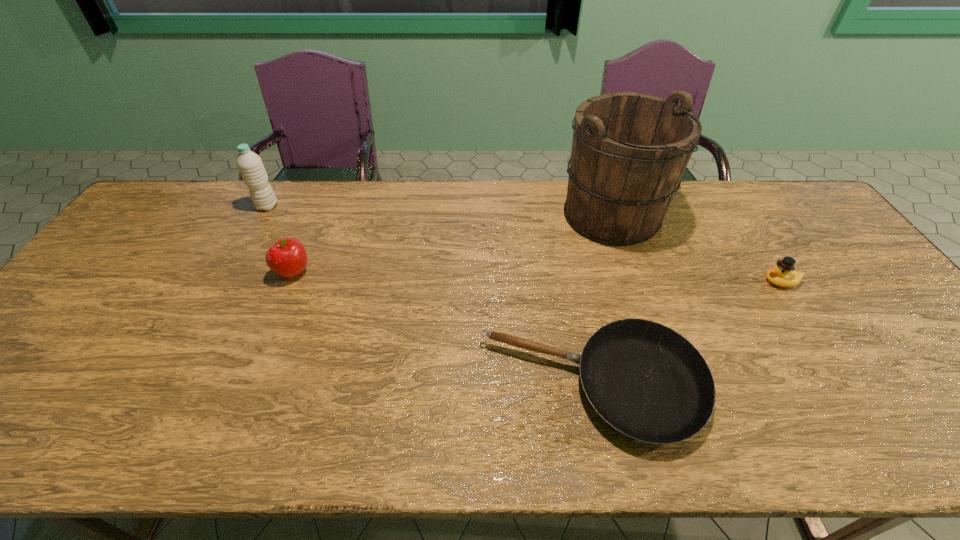
The image size is (960, 540). Identify the location of bucket. (629, 151).

The height and width of the screenshot is (540, 960). I want to click on the leftmost object, so click(x=250, y=165).

Identify the location of the second tallest object. (250, 165).

In order to click on apple in this screenshot , I will do `click(287, 258)`.

Where is `the second object from left to right`? the second object from left to right is located at coordinates (287, 258).

Find the location of a particular element. The width and height of the screenshot is (960, 540). the fourth tallest object is located at coordinates (782, 274).

Image resolution: width=960 pixels, height=540 pixels. What are the coordinates of `duck` in the screenshot? It's located at (782, 274).

You are a GUI agent. You are given a task and a screenshot of the screen. Output one action in this format:
    pyautogui.click(x=<x>, y=<y>)
    Task: Click on the shortest object
    Image resolution: width=960 pixels, height=540 pixels.
    Given the screenshot: What is the action you would take?
    pyautogui.click(x=647, y=381)

Where is `frying pan`? frying pan is located at coordinates (647, 381).

Image resolution: width=960 pixels, height=540 pixels. Identify the location of free region located on the right of the bucket. (703, 216).